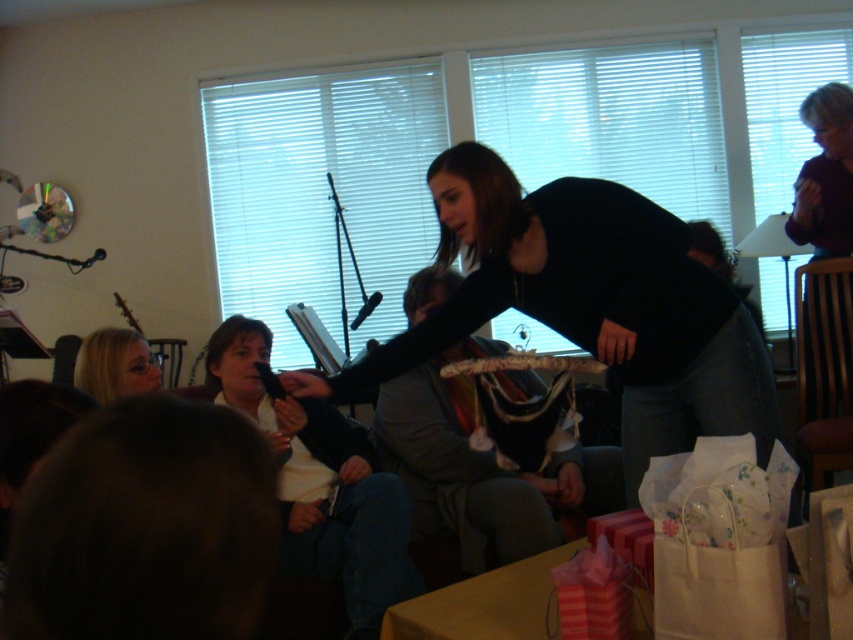
Question: Which object is farther from the camera taking this photo?

Choices:
 (A) gray fabric jacket at center
 (B) white matte shirt at center
 (C) black matte sweater at center

Answer: (A)

Question: Is gray fabric jacket at center wider than white matte shirt at center?

Choices:
 (A) yes
 (B) no

Answer: (A)

Question: Can you confirm if black matte sweater at center is positioned below gray fabric jacket at center?

Choices:
 (A) no
 (B) yes

Answer: (A)

Question: Which of the following is the farthest from the observer?

Choices:
 (A) black matte sweater at center
 (B) blonde hair at lower left

Answer: (B)

Question: Does black matte sweater at center have a larger size compared to gray fabric jacket at center?

Choices:
 (A) yes
 (B) no

Answer: (A)

Question: Among these points, which one is nearest to the camera?

Choices:
 (A) (273, 442)
 (B) (474, 349)

Answer: (A)